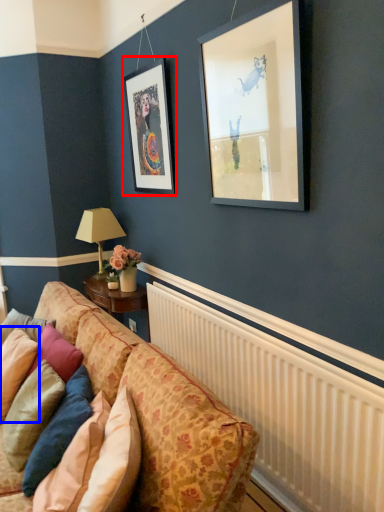
Question: Which object appears farthest to the camera in this image, picture frame (highlighted by a red box) or pillow (highlighted by a blue box)?

Choices:
 (A) picture frame
 (B) pillow

Answer: (A)